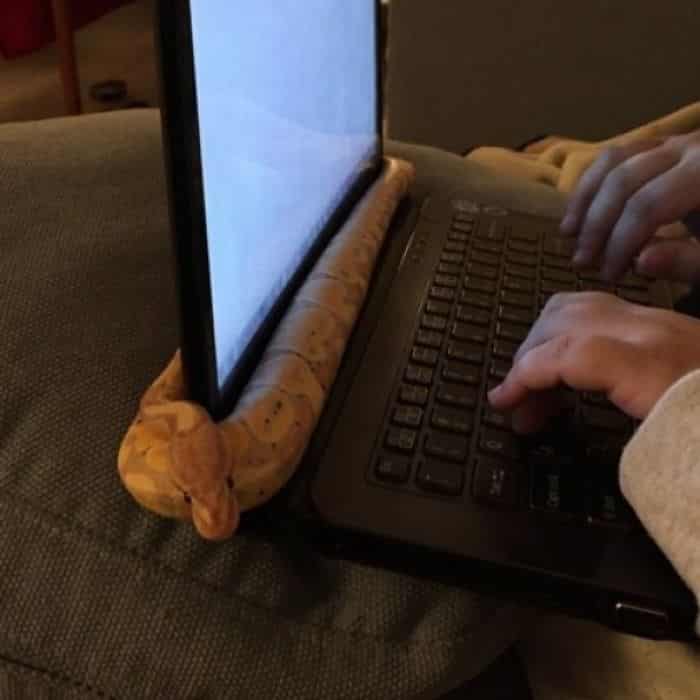
Locate an element on the screen. The height and width of the screenshot is (700, 700). laptop is located at coordinates (469, 497), (456, 346), (470, 250), (215, 253), (276, 216).